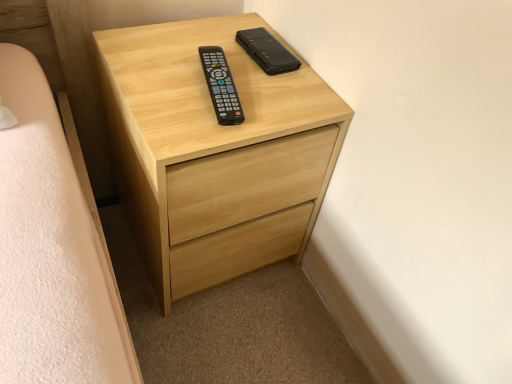
Locate an element on the screen. free location to the left of black plastic remote at center, the second control viewed from the back is located at coordinates (158, 82).